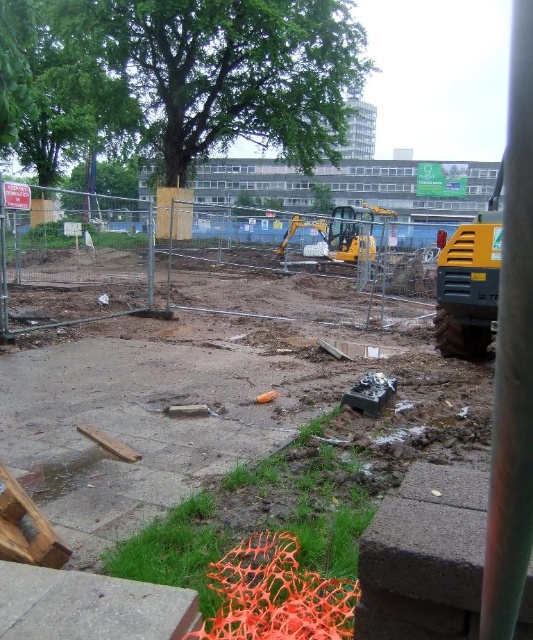
Question: Can you confirm if yellow rubber excavator at right is smaller than yellow metallic excavator at center?

Choices:
 (A) no
 (B) yes

Answer: (B)

Question: Estimate the real-world distances between objects in this image. Which object is closer to the yellow rubber excavator at right?

Choices:
 (A) yellow metallic excavator at center
 (B) green leafy tree at upper left
 (C) green leafy tree at upper center

Answer: (A)

Question: Which of the following is the closest to the observer?

Choices:
 (A) yellow rubber excavator at right
 (B) green leafy tree at upper left
 (C) green leafy tree at upper center

Answer: (A)

Question: Which of these objects is positioned farthest from the green leafy tree at upper center?

Choices:
 (A) yellow rubber excavator at right
 (B) yellow metallic excavator at center
 (C) green leafy tree at upper left

Answer: (A)

Question: Is yellow rubber excavator at right to the left of yellow metallic excavator at center from the viewer's perspective?

Choices:
 (A) no
 (B) yes

Answer: (A)

Question: Can you confirm if yellow metallic excavator at center is positioned below green leafy tree at upper center?

Choices:
 (A) yes
 (B) no

Answer: (A)